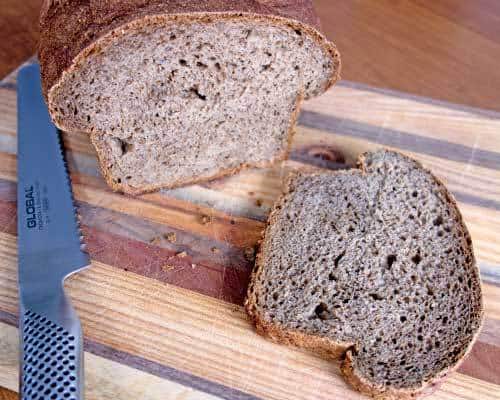
The image size is (500, 400). What are the coordinates of `knife handle` in the screenshot? It's located at (42, 348).